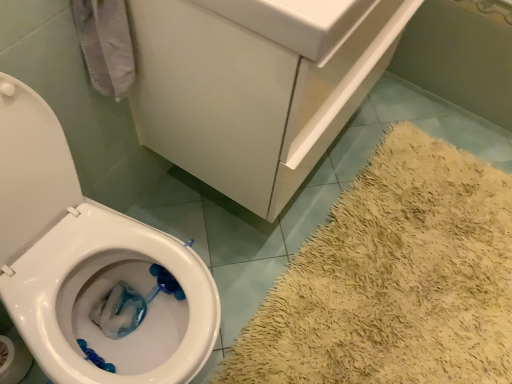
Find the location of a particular element. This screenshot has height=384, width=512. white glossy bathtub at lower right is located at coordinates (461, 55).

Describe the element at coordinates (13, 359) in the screenshot. I see `white paper at lower left` at that location.

What do you see at coordinates (297, 22) in the screenshot? The width and height of the screenshot is (512, 384). I see `white glossy sink at upper center` at bounding box center [297, 22].

This screenshot has width=512, height=384. I want to click on white glossy sink at upper center, so [x=297, y=22].

In order to click on white glossy bathtub at lower right in this screenshot , I will do `click(461, 55)`.

Is white paper at lower left to the right of white glossy sink at upper center from the viewer's perspective?

In fact, white paper at lower left is to the left of white glossy sink at upper center.

Is white paper at lower left far from white glossy sink at upper center?

Actually, white paper at lower left and white glossy sink at upper center are a little close together.

What's the angular difference between white paper at lower left and white glossy sink at upper center's facing directions?

They differ by 1.99 degrees in their facing directions.

Considering the sizes of white glossy bathtub at lower right and white glossy sink at upper center in the image, is white glossy bathtub at lower right taller or shorter than white glossy sink at upper center?

Clearly, white glossy bathtub at lower right is taller compared to white glossy sink at upper center.

In terms of size, does white glossy bathtub at lower right appear bigger or smaller than white glossy sink at upper center?

In the image, white glossy bathtub at lower right appears to be larger than white glossy sink at upper center.

Is white glossy bathtub at lower right in front of or behind white glossy sink at upper center in the image?

Clearly, white glossy bathtub at lower right is behind white glossy sink at upper center.

Based on the photo, from the image's perspective, is white glossy bathtub at lower right located above or below white glossy sink at upper center?

From the image's perspective, white glossy bathtub at lower right appears above white glossy sink at upper center.

In the image, is white glossy bathtub at lower right positioned in front of or behind white paper at lower left?

white glossy bathtub at lower right is positioned farther from the viewer than white paper at lower left.

Between white glossy bathtub at lower right and white paper at lower left, which one appears on the left side from the viewer's perspective?

white paper at lower left is more to the left.

Is white glossy bathtub at lower right inside the boundaries of white paper at lower left, or outside?

white glossy bathtub at lower right cannot be found inside white paper at lower left.

Is white glossy sink at upper center oriented towards white glossy bathtub at lower right?

No, white glossy sink at upper center is not oriented towards white glossy bathtub at lower right.

Is white glossy sink at upper center wider than white glossy bathtub at lower right?

No, white glossy sink at upper center is not wider than white glossy bathtub at lower right.

Based on the photo, considering the relative positions of white glossy sink at upper center and white glossy bathtub at lower right in the image provided, is white glossy sink at upper center behind white glossy bathtub at lower right?

No, white glossy sink at upper center is in front of white glossy bathtub at lower right.

From the image's perspective, between white glossy sink at upper center and white glossy bathtub at lower right, who is located below?

white glossy sink at upper center, from the image's perspective.

Considering the relative sizes of white glossy sink at upper center and white paper at lower left in the image provided, is white glossy sink at upper center taller than white paper at lower left?

In fact, white glossy sink at upper center may be shorter than white paper at lower left.

Based on the photo, is white glossy sink at upper center closer to camera compared to white paper at lower left?

That is True.

Can you tell me how much white glossy sink at upper center and white paper at lower left differ in facing direction?

1.99 degrees.

In the scene shown: Can you confirm if white glossy sink at upper center is positioned to the left of white paper at lower left?

Incorrect, white glossy sink at upper center is not on the left side of white paper at lower left.

From a real-world perspective, does white paper at lower left sit lower than white glossy bathtub at lower right?

Yes, from a real-world perspective, white paper at lower left is beneath white glossy bathtub at lower right.

From their relative heights in the image, would you say white paper at lower left is taller or shorter than white glossy bathtub at lower right?

Considering their sizes, white paper at lower left has less height than white glossy bathtub at lower right.

Is white paper at lower left wider or thinner than white glossy bathtub at lower right?

In the image, white paper at lower left appears to be more narrow than white glossy bathtub at lower right.

I want to click on sink above the white paper at lower left (from a real-world perspective), so click(297, 22).

At what (x,y) coordinates should I click in order to perform the action: click on bath above the white glossy sink at upper center (from the image's perspective). Please return your answer as a coordinate pair (x, y). This screenshot has width=512, height=384. Looking at the image, I should click on (461, 55).

Which object lies nearer to the anchor point white glossy sink at upper center, white glossy bathtub at lower right or white paper at lower left?

white paper at lower left.

From the image, which object appears to be nearer to white glossy bathtub at lower right, white paper at lower left or white glossy sink at upper center?

white glossy sink at upper center lies closer to white glossy bathtub at lower right than the other object.

From the image, which object appears to be farther from white paper at lower left, white glossy sink at upper center or white glossy bathtub at lower right?

Among the two, white glossy bathtub at lower right is located further to white paper at lower left.

Looking at the image, which one is located closer to white paper at lower left, white glossy bathtub at lower right or white glossy sink at upper center?

Among the two, white glossy sink at upper center is located nearer to white paper at lower left.

From the image, which object appears to be farther from white glossy bathtub at lower right, white glossy sink at upper center or white paper at lower left?

white paper at lower left.

Which object lies nearer to the anchor point white glossy sink at upper center, white paper at lower left or white glossy bathtub at lower right?

white paper at lower left.

Identify the location of sink situated between white paper at lower left and white glossy bathtub at lower right from left to right. Image resolution: width=512 pixels, height=384 pixels. (297, 22).